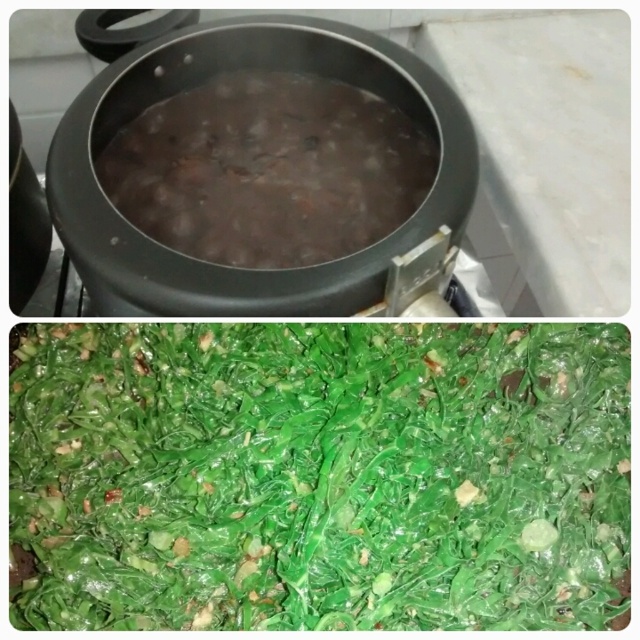
Question: Which of the following is the farthest from the observer?

Choices:
 (A) (218, 220)
 (B) (109, 566)

Answer: (B)

Question: Can you confirm if glossy green leafy vegetable at center is smaller than brown matte beans at center?

Choices:
 (A) yes
 (B) no

Answer: (B)

Question: Among these objects, which one is farthest from the camera?

Choices:
 (A) brown matte beans at center
 (B) glossy green leafy vegetable at center

Answer: (A)

Question: Is glossy green leafy vegetable at center further to the viewer compared to brown matte beans at center?

Choices:
 (A) yes
 (B) no

Answer: (B)

Question: Can you confirm if glossy green leafy vegetable at center is positioned to the right of brown matte beans at center?

Choices:
 (A) no
 (B) yes

Answer: (B)